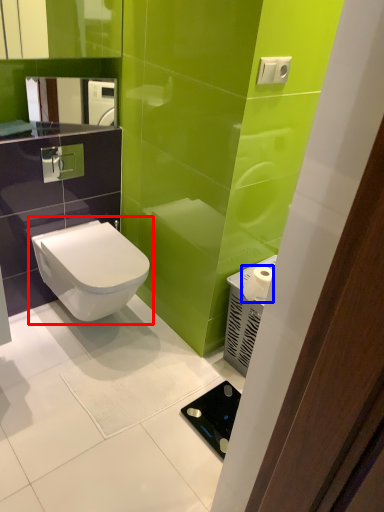
Question: Which point is closer to the camera, toilet (highlighted by a red box) or toilet paper (highlighted by a blue box)?

Choices:
 (A) toilet
 (B) toilet paper

Answer: (B)